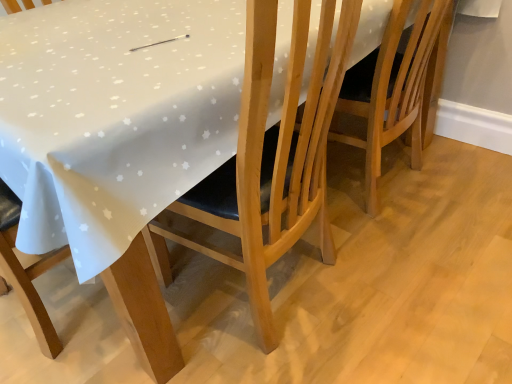
The image size is (512, 384). In order to click on free space in front of light brown wooden chair at center, which ranks as the first chair in right-to-left order in this screenshot , I will do `click(431, 272)`.